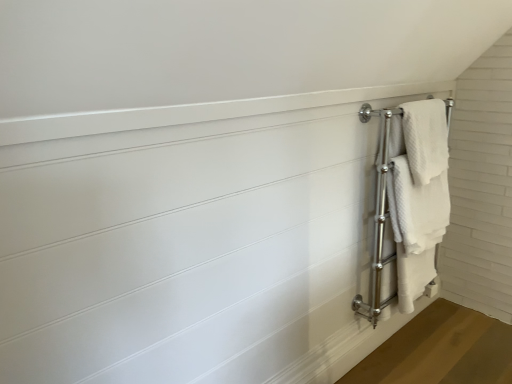
Measure the distance between point (434, 196) and camera.

They are 6.53 feet apart.

What is the approximate width of white textured towel at right, which is counted as the first bath towel, starting from the bottom?

4.58 inches.

Where is `white textured towel at right`? The width and height of the screenshot is (512, 384). white textured towel at right is located at coordinates (417, 207).

Image resolution: width=512 pixels, height=384 pixels. In order to click on white textured towel at right, acting as the 2th bath towel starting from the top in this screenshot , I will do `click(418, 194)`.

Does point (440, 142) appear closer or farther from the camera than point (424, 256)?

Point (440, 142).

Would you say white textured towel at right, the 1th bath towel in the top-to-bottom sequence, is a long distance from white textured towel at right, acting as the 2th bath towel starting from the top?

No, white textured towel at right, the 1th bath towel in the top-to-bottom sequence, is in close proximity to white textured towel at right, acting as the 2th bath towel starting from the top.

Is white textured towel at right, the 1th bath towel in the top-to-bottom sequence, turned away from white textured towel at right, which is counted as the first bath towel, starting from the bottom?

Yes.

From the image's perspective, which is below, white textured towel at right, the 1th bath towel in the top-to-bottom sequence, or white textured towel at right, acting as the 2th bath towel starting from the top?

white textured towel at right, acting as the 2th bath towel starting from the top, appears lower in the image.

Does white textured towel at right, the second bath towel ordered from the bottom, have a lesser height compared to white textured towel at right?

Yes.

From the image's perspective, does white textured towel at right, the second bath towel ordered from the bottom, appear lower than white textured towel at right?

No, from the image's perspective, white textured towel at right, the second bath towel ordered from the bottom, is not below white textured towel at right.

In the image, there is a white textured towel at right, the second bath towel ordered from the bottom. Identify the location of towel below it (from the image's perspective). (417, 207).

Does point (408, 183) come in front of point (430, 162)?

That is True.

Considering the relative sizes of white textured towel at right and white textured towel at right, the second bath towel ordered from the bottom, in the image provided, is white textured towel at right smaller than white textured towel at right, the second bath towel ordered from the bottom,?

Incorrect, white textured towel at right is not smaller in size than white textured towel at right, the second bath towel ordered from the bottom.

Is white textured towel at right directly adjacent to white textured towel at right, the 1th bath towel in the top-to-bottom sequence?

white textured towel at right and white textured towel at right, the 1th bath towel in the top-to-bottom sequence, are clearly separated.

Could you tell me if white textured towel at right is turned towards white textured towel at right, the second bath towel ordered from the bottom?

No, white textured towel at right is not turned towards white textured towel at right, the second bath towel ordered from the bottom.

Is white textured towel at right far away from white textured towel at right, which is counted as the first bath towel, starting from the bottom?

They are positioned close to each other.

Looking at this image, considering the positions of objects white textured towel at right and white textured towel at right, which is counted as the first bath towel, starting from the bottom, in the image provided, who is in front, white textured towel at right or white textured towel at right, which is counted as the first bath towel, starting from the bottom,?

white textured towel at right, which is counted as the first bath towel, starting from the bottom, is more forward.

Starting from the white textured towel at right, which bath towel is the 2nd one in front? Please provide its 2D coordinates.

[(418, 194)]

From a real-world perspective, is white textured towel at right, acting as the 2th bath towel starting from the top, physically located above or below white textured towel at right, the second bath towel ordered from the bottom?

white textured towel at right, acting as the 2th bath towel starting from the top, is situated lower than white textured towel at right, the second bath towel ordered from the bottom, in the real world.

From the image's perspective, which is above, white textured towel at right, which is counted as the first bath towel, starting from the bottom, or white textured towel at right, the 1th bath towel in the top-to-bottom sequence?

white textured towel at right, the 1th bath towel in the top-to-bottom sequence, appears higher in the image.

Is white textured towel at right, which is counted as the first bath towel, starting from the bottom, positioned far away from white textured towel at right, the 1th bath towel in the top-to-bottom sequence?

No, white textured towel at right, which is counted as the first bath towel, starting from the bottom, is not far from white textured towel at right, the 1th bath towel in the top-to-bottom sequence.

Considering the relative positions of white textured towel at right, acting as the 2th bath towel starting from the top, and white textured towel at right, the 1th bath towel in the top-to-bottom sequence, in the image provided, is white textured towel at right, acting as the 2th bath towel starting from the top, in front of white textured towel at right, the 1th bath towel in the top-to-bottom sequence,?

Yes.

Is white textured towel at right, acting as the 2th bath towel starting from the top, aimed at white textured towel at right?

Yes, white textured towel at right, acting as the 2th bath towel starting from the top, is oriented towards white textured towel at right.

Relative to white textured towel at right, is white textured towel at right, acting as the 2th bath towel starting from the top, in front or behind?

Clearly, white textured towel at right, acting as the 2th bath towel starting from the top, is in front of white textured towel at right.

From the image's perspective, which one is positioned higher, white textured towel at right, which is counted as the first bath towel, starting from the bottom, or white textured towel at right?

white textured towel at right, from the image's perspective.

How far apart are white textured towel at right, acting as the 2th bath towel starting from the top, and white textured towel at right?

white textured towel at right, acting as the 2th bath towel starting from the top, and white textured towel at right are 2.22 inches apart from each other.

The image size is (512, 384). I want to click on bath towel on the right of white textured towel at right, acting as the 2th bath towel starting from the top, so click(425, 139).

Find the location of a particular element. The height and width of the screenshot is (384, 512). bath towel that is the 1st object located in front of the white textured towel at right is located at coordinates (425, 139).

Based on their spatial positions, is white textured towel at right or white textured towel at right, the second bath towel ordered from the bottom, further from white textured towel at right, which is counted as the first bath towel, starting from the bottom?

white textured towel at right, the second bath towel ordered from the bottom.

Based on their spatial positions, is white textured towel at right, which is counted as the first bath towel, starting from the bottom, or white textured towel at right further from white textured towel at right, the second bath towel ordered from the bottom?

The object further to white textured towel at right, the second bath towel ordered from the bottom, is white textured towel at right.

Looking at the image, which one is located closer to white textured towel at right, the second bath towel ordered from the bottom, white textured towel at right or white textured towel at right, acting as the 2th bath towel starting from the top?

The object closer to white textured towel at right, the second bath towel ordered from the bottom, is white textured towel at right, acting as the 2th bath towel starting from the top.

When comparing their distances from white textured towel at right, does white textured towel at right, the second bath towel ordered from the bottom, or white textured towel at right, which is counted as the first bath towel, starting from the bottom, seem closer?

white textured towel at right, which is counted as the first bath towel, starting from the bottom, is positioned closer to the anchor white textured towel at right.

Considering their positions, is white textured towel at right, the 1th bath towel in the top-to-bottom sequence, positioned further to white textured towel at right, acting as the 2th bath towel starting from the top, than white textured towel at right?

white textured towel at right, the 1th bath towel in the top-to-bottom sequence.

Estimate the real-world distances between objects in this image. Which object is further from white textured towel at right, white textured towel at right, acting as the 2th bath towel starting from the top, or white textured towel at right, the second bath towel ordered from the bottom?

white textured towel at right, the second bath towel ordered from the bottom, is positioned further to the anchor white textured towel at right.

At what (x,y) coordinates should I click in order to perform the action: click on towel between white textured towel at right, the 1th bath towel in the top-to-bottom sequence, and white textured towel at right, acting as the 2th bath towel starting from the top, in the up-down direction. Please return your answer as a coordinate pair (x, y). Looking at the image, I should click on (417, 207).